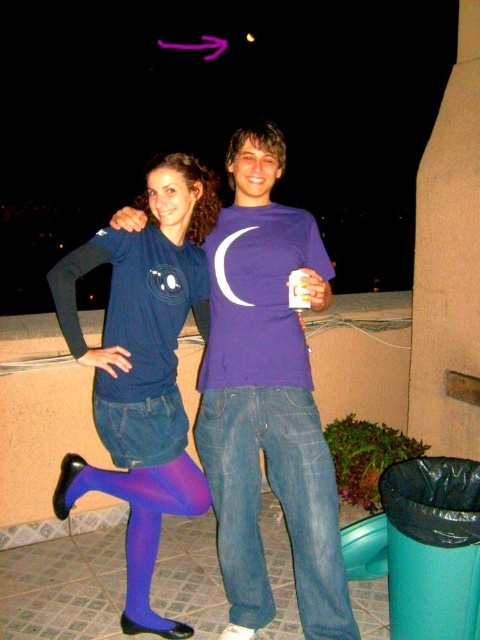
Question: Is the position of purple tights at center less distant than that of jeans at center?

Choices:
 (A) yes
 (B) no

Answer: (A)

Question: Is purple matte t-shirt at center thinner than jeans at center?

Choices:
 (A) no
 (B) yes

Answer: (A)

Question: Where is purple tights at center located in relation to jeans at center in the image?

Choices:
 (A) right
 (B) left

Answer: (B)

Question: Which object appears closest to the camera in this image?

Choices:
 (A) jeans at center
 (B) purple matte t-shirt at center
 (C) purple tights at center

Answer: (C)

Question: Which point is closer to the camera?

Choices:
 (A) jeans at center
 (B) purple tights at center
 (C) purple matte t-shirt at center

Answer: (B)

Question: Among these points, which one is nearest to the camera?

Choices:
 (A) (215, 467)
 (B) (154, 458)

Answer: (A)